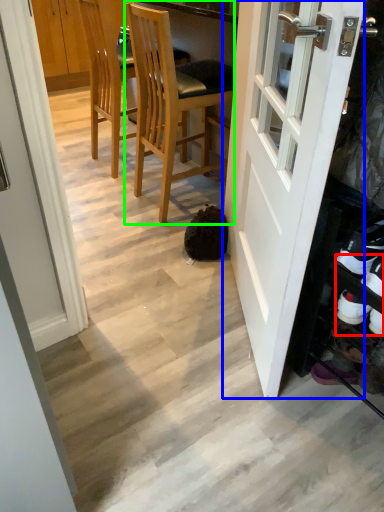
Question: Based on their relative distances, which object is farther from shoe (highlighted by a red box)? Choose from door (highlighted by a blue box) and chair (highlighted by a green box).

Choices:
 (A) door
 (B) chair

Answer: (B)